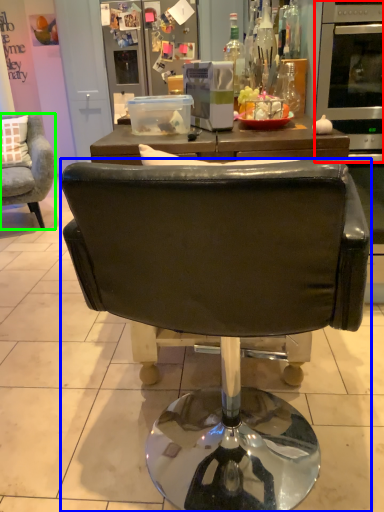
Question: Which object is the closest to the oven (highlighted by a red box)? Choose among these: chair (highlighted by a blue box) or chair (highlighted by a green box).

Choices:
 (A) chair
 (B) chair

Answer: (A)